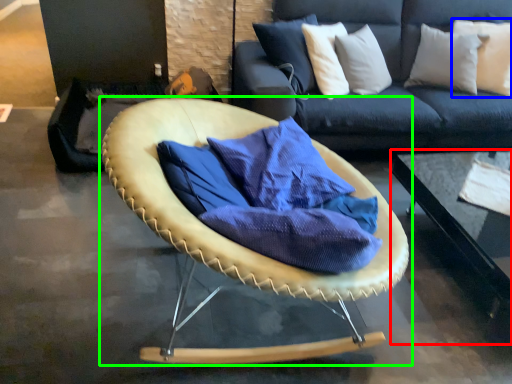
Question: Based on their relative distances, which object is farther from table (highlighted by a red box)? Choose from pillow (highlighted by a blue box) and chair (highlighted by a green box).

Choices:
 (A) pillow
 (B) chair

Answer: (B)